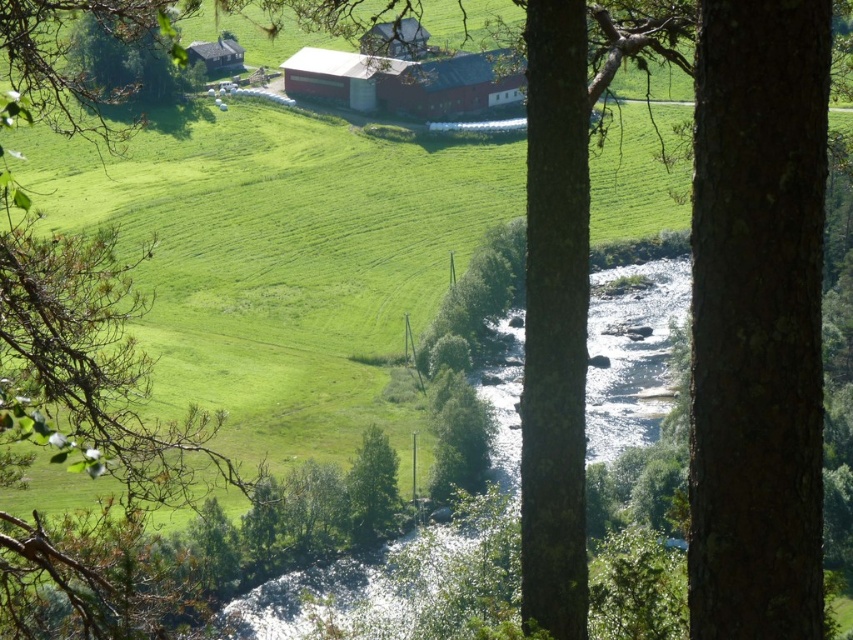
Can you confirm if brown rough bark tree at center right is positioned below wooden cabin at upper left?

Yes, brown rough bark tree at center right is below wooden cabin at upper left.

Is point (758, 534) positioned behind point (242, 61)?

No, (758, 534) is closer to viewer.

Which is behind, point (828, 61) or point (215, 44)?

The point (215, 44) is more distant.

Locate an element on the screen. The width and height of the screenshot is (853, 640). brown rough bark tree at center right is located at coordinates (757, 317).

Between brown rough bark tree at center right and green leafy tree at center, which one appears on the left side from the viewer's perspective?

green leafy tree at center

Does brown rough bark tree at center right have a greater width compared to green leafy tree at center?

In fact, brown rough bark tree at center right might be narrower than green leafy tree at center.

Is point (738, 115) more distant than point (364, 513)?

That is False.

Locate an element on the screen. Image resolution: width=853 pixels, height=640 pixels. brown rough bark tree at center right is located at coordinates (757, 317).

Does brown rough bark tree at center right appear under red matte barn at center?

Indeed, brown rough bark tree at center right is positioned under red matte barn at center.

Can you confirm if brown rough bark tree at center right is bigger than red matte barn at center?

Actually, brown rough bark tree at center right might be smaller than red matte barn at center.

Is point (751, 628) positioned behind point (339, 60)?

No, (751, 628) is closer to viewer.

Where is `brown rough bark tree at center right`? This screenshot has width=853, height=640. brown rough bark tree at center right is located at coordinates (757, 317).